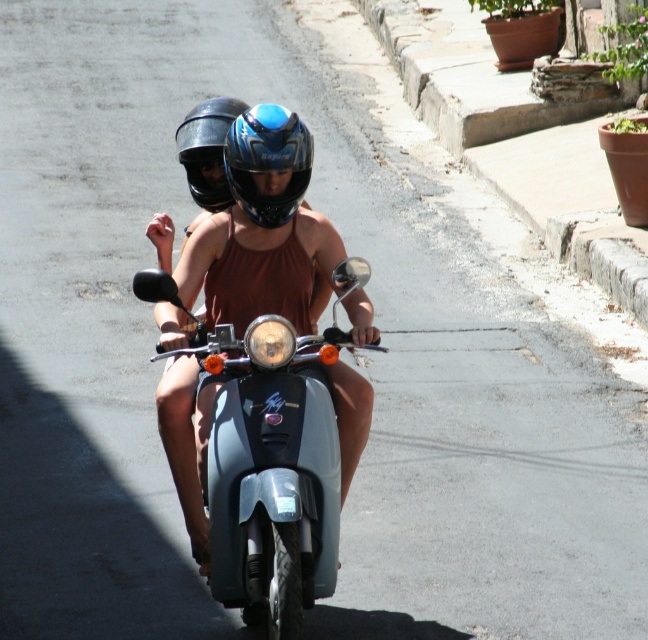
Question: Which of the following is the closest to the observer?

Choices:
 (A) metallic blue scooter at center
 (B) shiny black helmet at center
 (C) blue glossy helmet at center

Answer: (A)

Question: Does metallic blue scooter at center appear under shiny black helmet at center?

Choices:
 (A) yes
 (B) no

Answer: (A)

Question: Which point is closer to the camera?

Choices:
 (A) (307, 410)
 (B) (272, 221)

Answer: (A)

Question: Which object is positioned farthest from the blue glossy helmet at center?

Choices:
 (A) shiny black helmet at center
 (B) metallic blue scooter at center

Answer: (B)

Question: Does blue glossy helmet at center appear over shiny black helmet at center?

Choices:
 (A) yes
 (B) no

Answer: (B)

Question: Does blue glossy helmet at center appear on the left side of shiny black helmet at center?

Choices:
 (A) no
 (B) yes

Answer: (A)